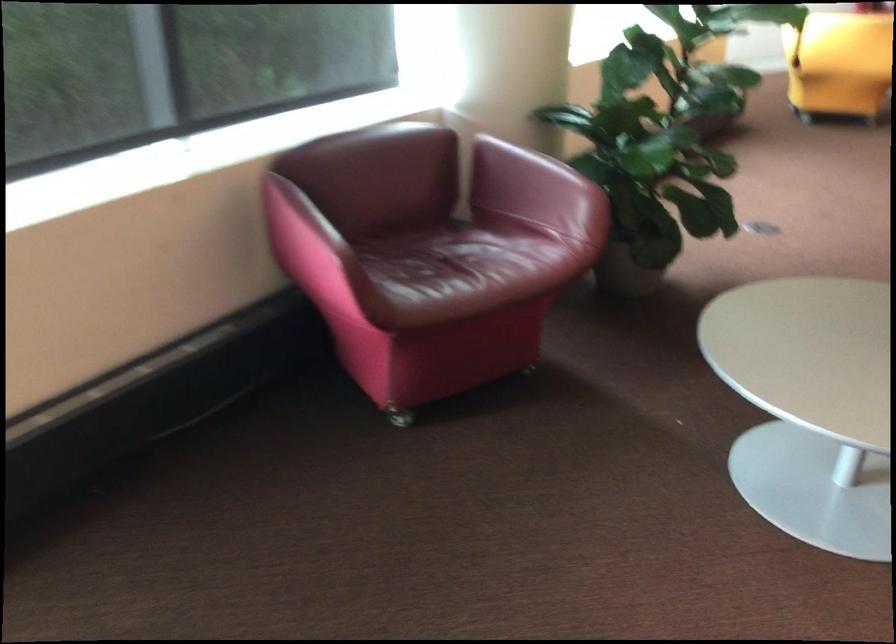
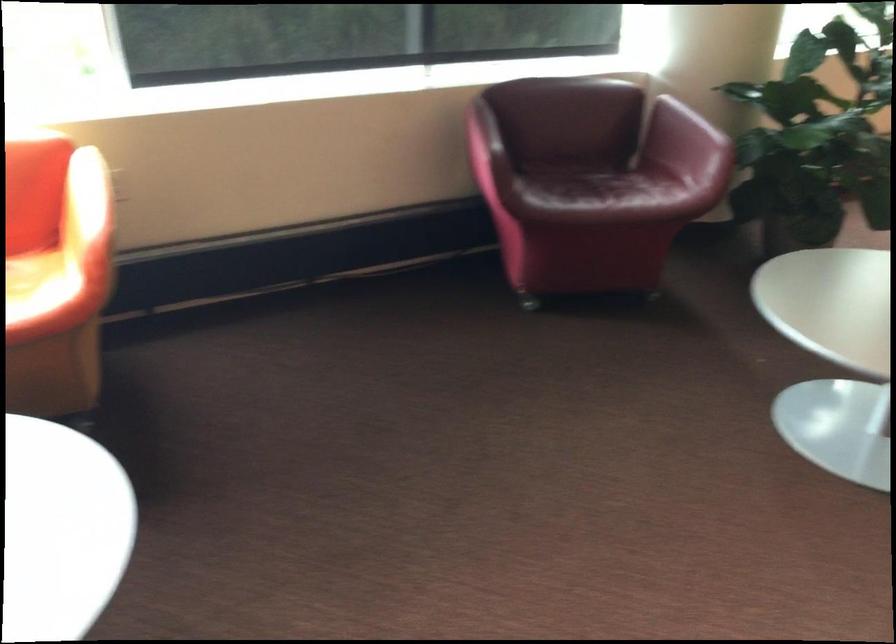
Locate, in the second image, the point that corresponds to point (487, 272) in the first image.

(608, 194)